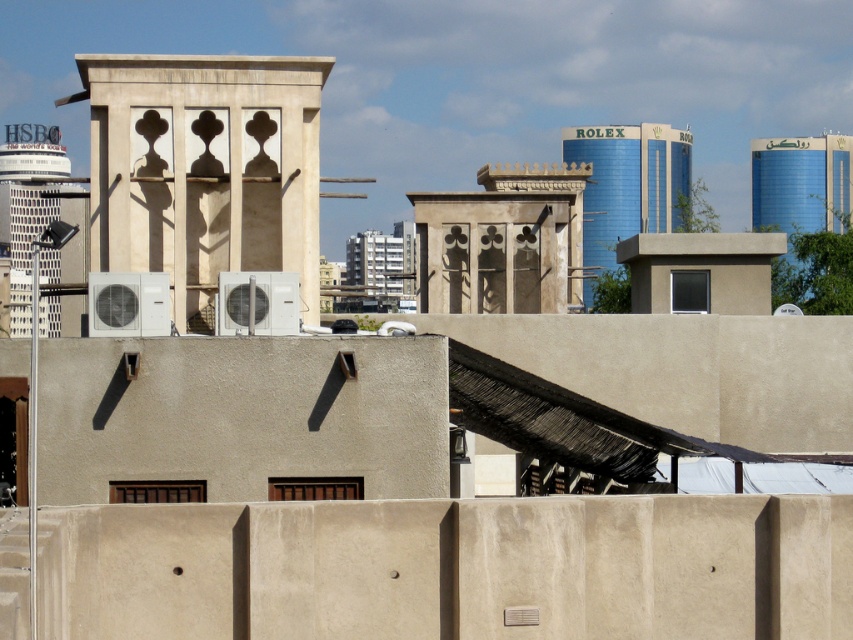
Based on the scene described, which tower is positioned to the right when viewed from the observer standing in front of the beige concrete tower at center and white concrete tower at left?

The beige concrete tower at center is positioned to the right of the white concrete tower at left, so when viewed from the observer standing in front of them, the beige concrete tower at center is on the right side.

You are an architect designing a new building that needs to be placed between the blue glass tower at upper right and the blue metallic tower at upper right. The new building will be 5 meters wide. Is there enough space between them to accommodate the new building?

The blue glass tower at upper right and blue metallic tower at upper right are 11.24 meters apart from each other. Since the new building is 5 meters wide, there is sufficient space between them to accommodate the new building as 11.24 meters is greater than 5 meters.

You are standing in front of the beige concrete tower at center. You want to take a photo of it with your camera, which has a maximum focus range of 30 meters. Can you capture the entire tower in focus without moving closer?

The distance between you and the beige concrete tower at center is 32.00 meters, which exceeds the camera maximum focus range of 30 meters. Therefore, you cannot capture the entire tower in focus without moving closer.